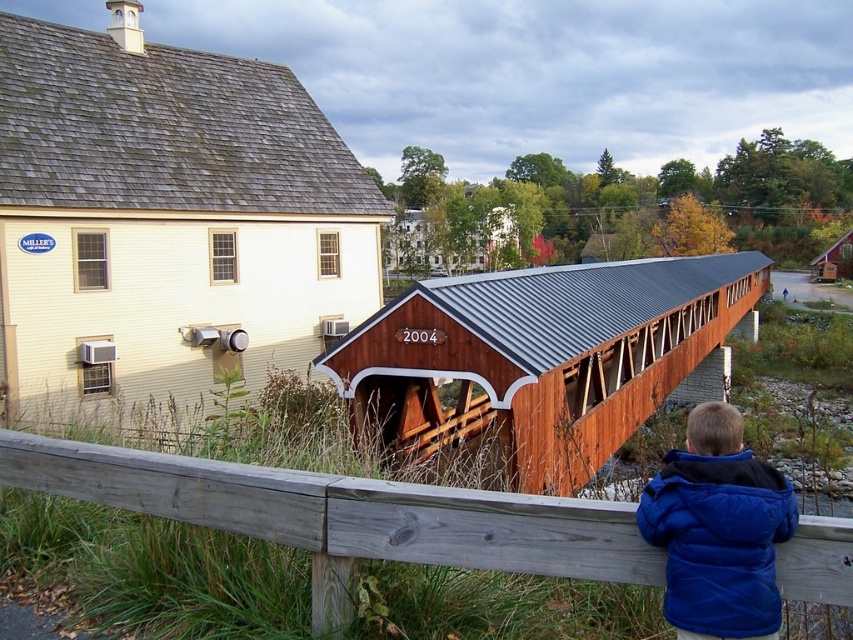
In order to click on gray wood fence at lower center in this screenshot , I will do `click(345, 515)`.

Which is below, gray wood fence at lower center or blue fleece jacket at lower right?

gray wood fence at lower center

Who is more forward, (515, 556) or (659, 515)?

Point (659, 515)

At what (x,y) coordinates should I click in order to perform the action: click on gray wood fence at lower center. Please return your answer as a coordinate pair (x, y). The image size is (853, 640). Looking at the image, I should click on (345, 515).

In the scene shown: Between wooden bridge at center and gray wood fence at lower center, which one appears on the right side from the viewer's perspective?

Positioned to the right is wooden bridge at center.

Does wooden bridge at center appear over gray wood fence at lower center?

Yes.

Is point (408, 401) behind point (780, 561)?

Yes, point (408, 401) is behind point (780, 561).

Identify the location of wooden bridge at center. (541, 356).

Does wooden bridge at center appear over blue fleece jacket at lower right?

Result: Yes.

Is wooden bridge at center in front of blue fleece jacket at lower right?

No.

Does point (434, 392) come farther from viewer compared to point (757, 572)?

That is True.

Find the location of a particular element. This screenshot has height=640, width=853. wooden bridge at center is located at coordinates click(541, 356).